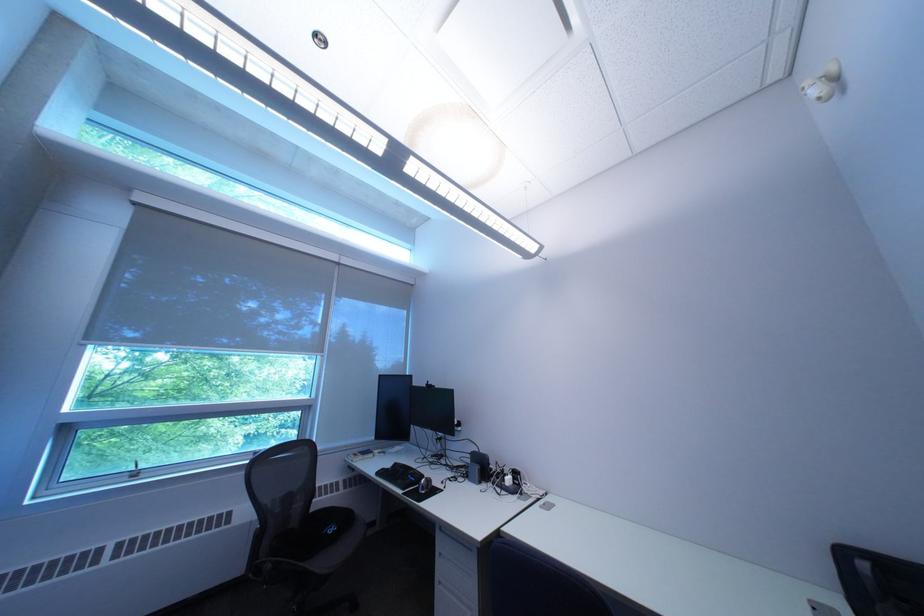
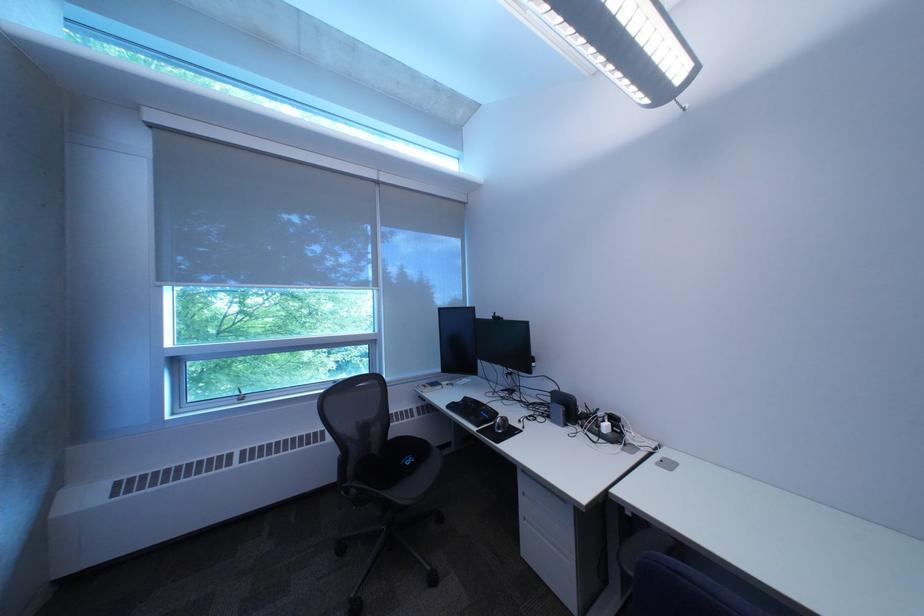
In the second image, find the point that corresponds to (x=555, y=509) in the first image.

(673, 466)